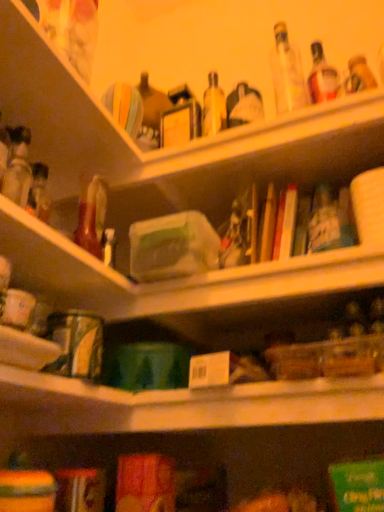
Describe the element at coordinates (57, 106) in the screenshot. The image size is (384, 512). I see `matte plastic bag at upper left` at that location.

Measure the distance between matte plastic bag at upper left and camera.

matte plastic bag at upper left and camera are 26.65 inches apart from each other.

Locate an element on the screen. Image resolution: width=384 pixels, height=512 pixels. matte plastic bag at upper left is located at coordinates pos(57,106).

What is the approximate height of translucent glass bottle at left?

translucent glass bottle at left is 8.59 inches tall.

In order to face translucent glass bottle at left, should I rotate leftwards or rightwards?

A 24.156 degree turn to the left will do.

This screenshot has height=512, width=384. What do you see at coordinates (18, 166) in the screenshot?
I see `translucent glass bottle at left` at bounding box center [18, 166].

The height and width of the screenshot is (512, 384). I want to click on translucent glass bottle at left, so click(18, 166).

I want to click on matte plastic bag at upper left, so click(57, 106).

Which object is positioned more to the right, translucent glass bottle at left or matte plastic bag at upper left?

matte plastic bag at upper left.

Considering their positions, is translucent glass bottle at left located in front of or behind matte plastic bag at upper left?

translucent glass bottle at left is in front of matte plastic bag at upper left.

Which is behind, point (13, 191) or point (11, 12)?

The point (13, 191) is behind.

From the image's perspective, is translucent glass bottle at left on matte plastic bag at upper left?

No, from the image's perspective, translucent glass bottle at left is not on top of matte plastic bag at upper left.

From a real-world perspective, which object stands above the other?

matte plastic bag at upper left is physically above.

Which object is thinner, translucent glass bottle at left or matte plastic bag at upper left?

translucent glass bottle at left.

In terms of height, does translucent glass bottle at left look taller or shorter compared to matte plastic bag at upper left?

In the image, translucent glass bottle at left appears to be shorter than matte plastic bag at upper left.

Considering the sizes of translucent glass bottle at left and matte plastic bag at upper left in the image, is translucent glass bottle at left bigger or smaller than matte plastic bag at upper left?

translucent glass bottle at left is smaller than matte plastic bag at upper left.

Would you say translucent glass bottle at left is outside matte plastic bag at upper left?

Yes, translucent glass bottle at left is located beyond the bounds of matte plastic bag at upper left.

In the scene shown: Would you consider translucent glass bottle at left to be distant from matte plastic bag at upper left?

No, there isn't a large distance between translucent glass bottle at left and matte plastic bag at upper left.

Is translucent glass bottle at left oriented away from matte plastic bag at upper left?

No.

How many degrees apart are the facing directions of translucent glass bottle at left and matte plastic bag at upper left?

The facing directions of translucent glass bottle at left and matte plastic bag at upper left are 3.43 degrees apart.

Consider the image. How far apart are translucent glass bottle at left and matte plastic bag at upper left?

The distance of translucent glass bottle at left from matte plastic bag at upper left is 5.04 inches.

Where is `shelf on the right of the translucent glass bottle at left`? This screenshot has width=384, height=512. shelf on the right of the translucent glass bottle at left is located at coordinates (57, 106).

Between matte plastic bag at upper left and translucent glass bottle at left, which one appears on the left side from the viewer's perspective?

Positioned to the left is translucent glass bottle at left.

Is the position of matte plastic bag at upper left more distant than that of translucent glass bottle at left?

That is True.

Which is nearer, (36, 27) or (25, 133)?

Point (36, 27).

From the image's perspective, is matte plastic bag at upper left located beneath translucent glass bottle at left?

Actually, matte plastic bag at upper left appears above translucent glass bottle at left in the image.

From a real-world perspective, is matte plastic bag at upper left on translucent glass bottle at left?

Yes, from a real-world perspective, matte plastic bag at upper left is on top of translucent glass bottle at left.

Is matte plastic bag at upper left thinner than translucent glass bottle at left?

No.

Considering the relative sizes of matte plastic bag at upper left and translucent glass bottle at left in the image provided, is matte plastic bag at upper left taller than translucent glass bottle at left?

Indeed, matte plastic bag at upper left has a greater height compared to translucent glass bottle at left.

Based on their sizes in the image, would you say matte plastic bag at upper left is bigger or smaller than translucent glass bottle at left?

In the image, matte plastic bag at upper left appears to be larger than translucent glass bottle at left.

Does matte plastic bag at upper left contain translucent glass bottle at left?

No, translucent glass bottle at left is located outside of matte plastic bag at upper left.

Is the surface of matte plastic bag at upper left in direct contact with translucent glass bottle at left?

No, matte plastic bag at upper left is not making contact with translucent glass bottle at left.

Is matte plastic bag at upper left oriented away from translucent glass bottle at left?

No, matte plastic bag at upper left is not facing away from translucent glass bottle at left.

Measure the distance from matte plastic bag at upper left to translucent glass bottle at left.

The distance of matte plastic bag at upper left from translucent glass bottle at left is 5.04 inches.

Find the location of a particular element. bottle in front of the matte plastic bag at upper left is located at coordinates (18, 166).

Locate an element on the screen. The image size is (384, 512). shelf located above the translucent glass bottle at left (from a real-world perspective) is located at coordinates (57, 106).

Image resolution: width=384 pixels, height=512 pixels. Find the location of `bottle that is below the matte plastic bag at upper left (from the image's perspective)`. bottle that is below the matte plastic bag at upper left (from the image's perspective) is located at coordinates (18, 166).